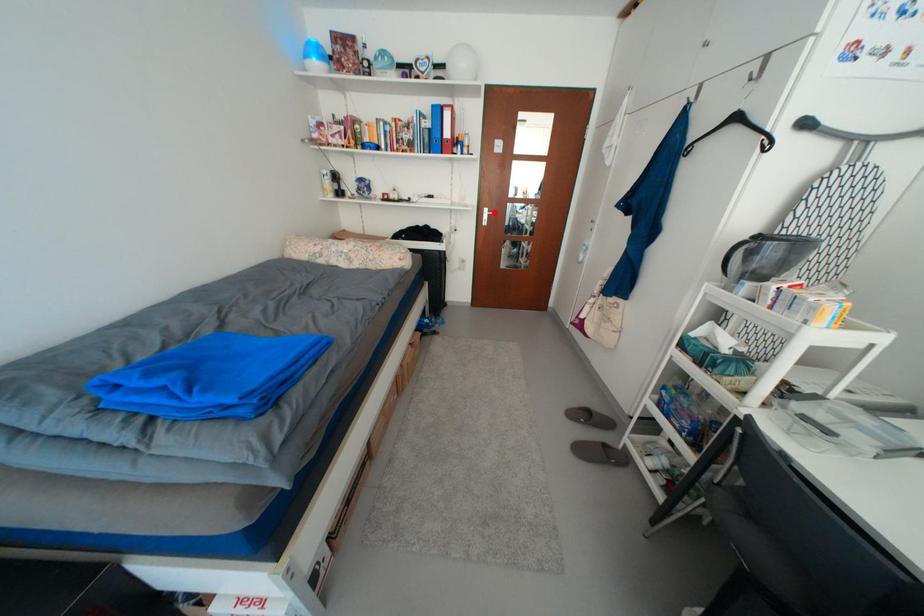
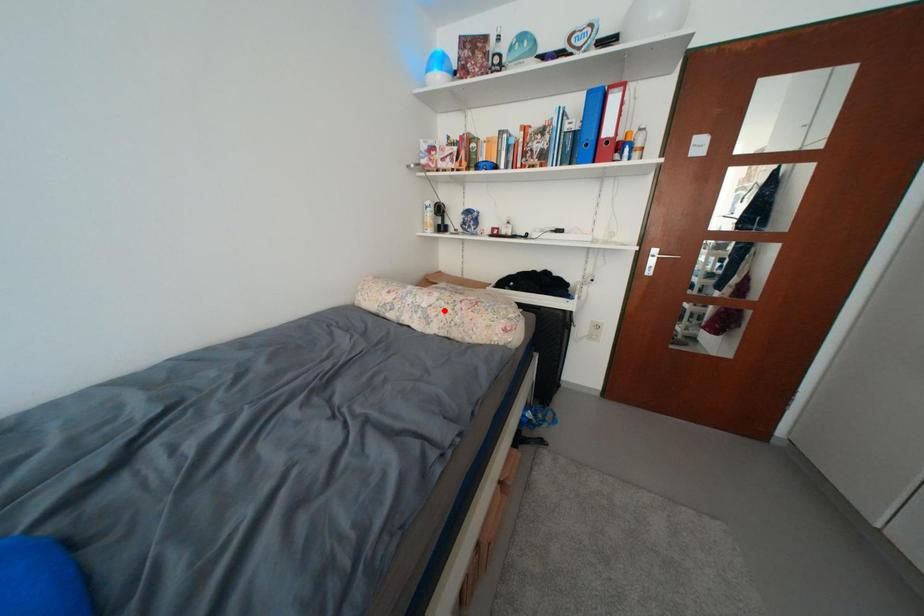
I am providing you with two images of the same scene from different viewpoints. A red point is marked on the first image and another point is marked on the second image. Are the points marked in image1 and image2 representing the same 3D position?

No